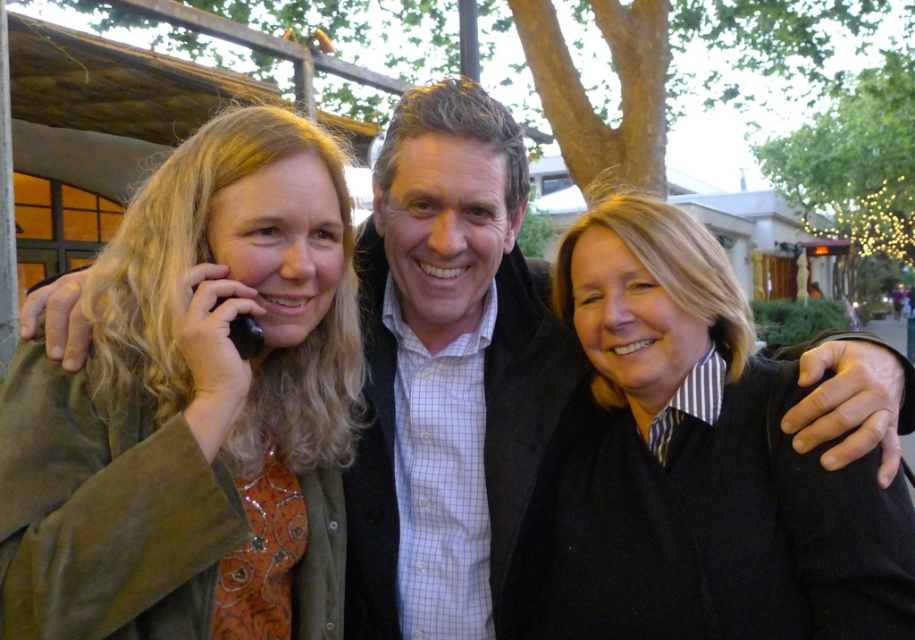
Question: Does black wool sweater at center appear under white checkered shirt at center?

Choices:
 (A) no
 (B) yes

Answer: (B)

Question: Estimate the real-world distances between objects in this image. Which object is farther from the white checkered shirt at center?

Choices:
 (A) black wool sweater at center
 (B) matte green jacket at left

Answer: (B)

Question: Does black wool sweater at center lie behind white checkered shirt at center?

Choices:
 (A) yes
 (B) no

Answer: (B)

Question: Which of these objects is positioned closest to the white checkered shirt at center?

Choices:
 (A) black wool sweater at center
 (B) matte green jacket at left

Answer: (A)

Question: Among these points, which one is farthest from the camera?

Choices:
 (A) (709, 284)
 (B) (326, 225)
 (C) (526, 291)

Answer: (C)

Question: Is the position of matte green jacket at left less distant than that of white checkered shirt at center?

Choices:
 (A) yes
 (B) no

Answer: (A)